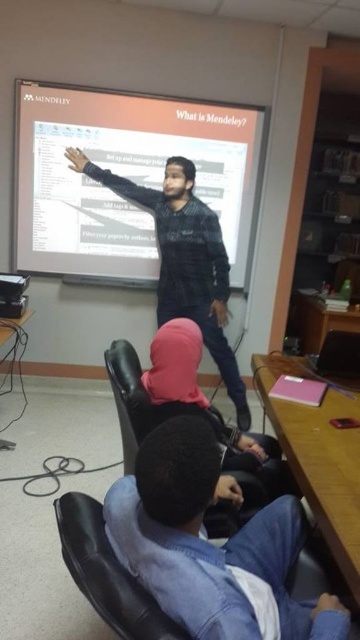
You are a student in the classroom and you want to borrow a jacket from the blue denim jacket at lower right and the black textured sweater at center. Which one can you reach without moving from your seat?

The blue denim jacket at lower right can be reached without moving from your seat because it is shorter than the black textured sweater at center, making it more accessible.

You are a student sitting at the back of the classroom and want to see the presenter clearly. The presenter is wearing a black textured sweater at center. There is also a blue denim jacket at lower right in the image. Which clothing item is closer to you?

The blue denim jacket at lower right is closer to you because it is in front of the black textured sweater at center.

You are a student sitting at the back of the classroom. You want to look at the blue denim jacket at lower right but also need to keep an eye on the white matte projector screen at upper center. Which object will you look at first if you raise your head upwards?

The white matte projector screen at upper center is located above the blue denim jacket at lower right, so if you raise your head upwards, you will first see the white matte projector screen at upper center before the blue denim jacket at lower right.